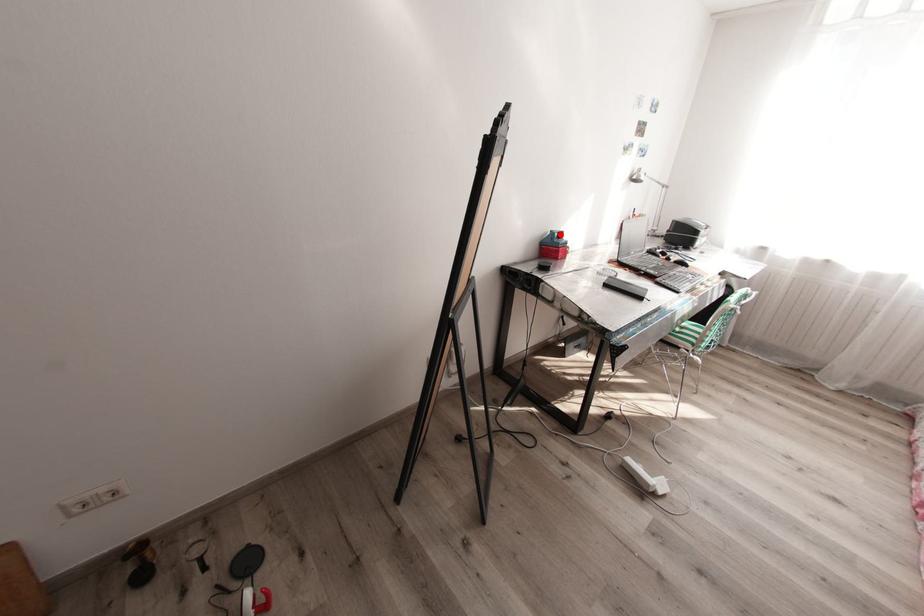
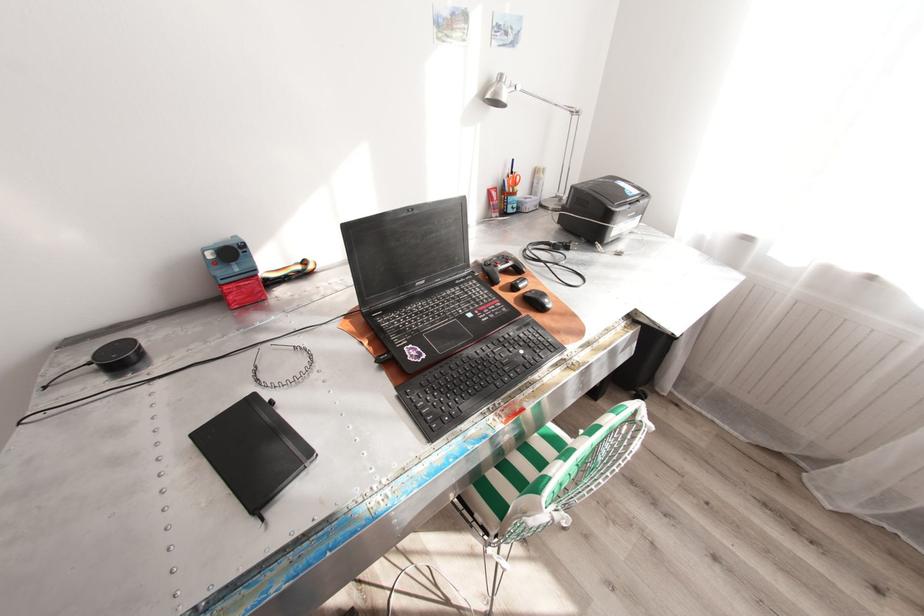
Find the pixel in the second image that matches the highlighted location in the first image.

(215, 254)